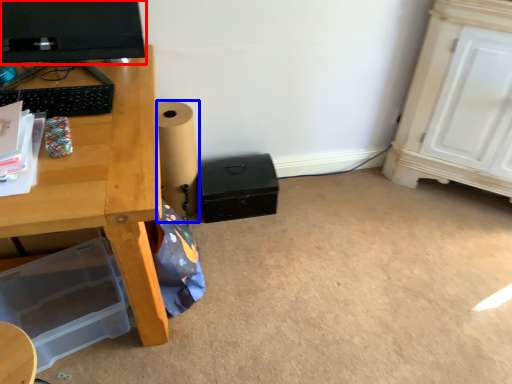
Question: Which object is closer to the camera taking this photo, computer monitor (highlighted by a red box) or speaker (highlighted by a blue box)?

Choices:
 (A) computer monitor
 (B) speaker

Answer: (A)